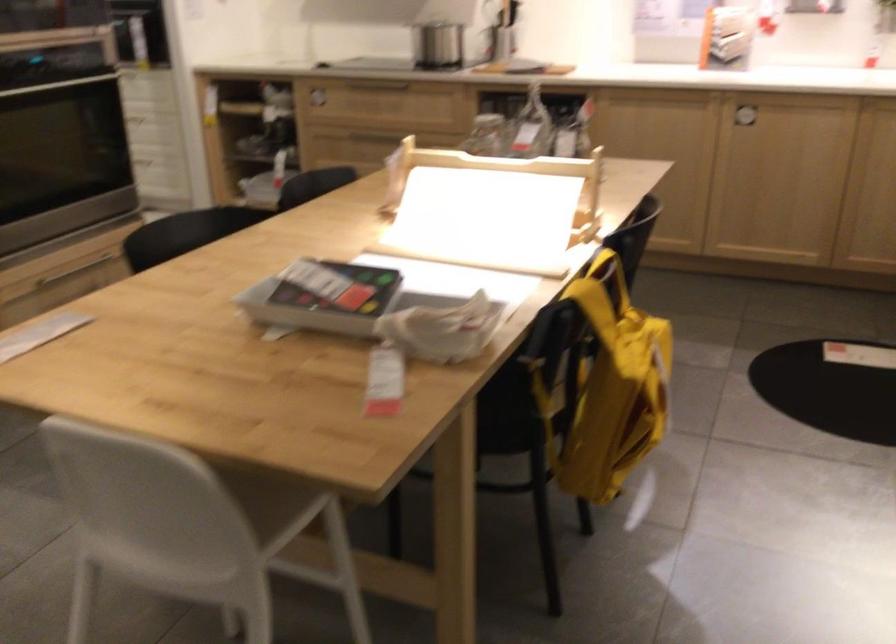
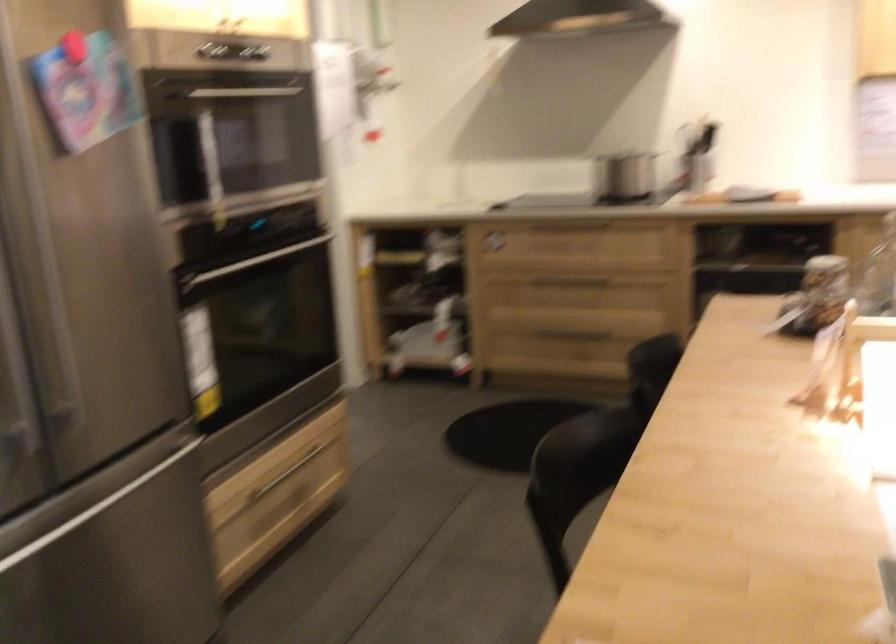
Question: Based on the continuous images, in which direction is the camera rotating? Reply with the corresponding letter.

Choices:
 (A) Left
 (B) Right
 (C) Up
 (D) Down

Answer: (C)